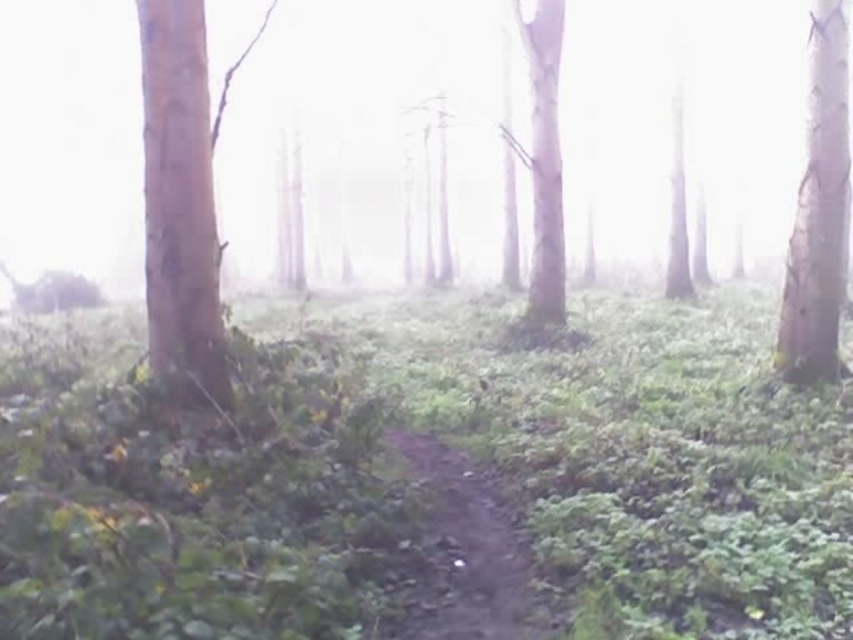
Question: Can you confirm if green leafy vegetation at center is wider than smooth brown tree trunk at left?

Choices:
 (A) no
 (B) yes

Answer: (B)

Question: Which of the following is the closest to the observer?

Choices:
 (A) smooth bark tree at center
 (B) dirt path at center
 (C) smooth brown tree trunk at left
 (D) green leafy vegetation at center

Answer: (D)

Question: Which point is closer to the camera?

Choices:
 (A) smooth bark tree at center
 (B) dirt path at center
 (C) foggy translucent forest at center
 (D) green leafy vegetation at center

Answer: (D)

Question: Considering the relative positions of foggy translucent forest at center and smooth white tree at right in the image provided, where is foggy translucent forest at center located with respect to smooth white tree at right?

Choices:
 (A) below
 (B) above

Answer: (B)

Question: Among these points, which one is nearest to the camera?

Choices:
 (A) (531, 289)
 (B) (466, 492)
 (C) (202, 68)
 (D) (838, 45)

Answer: (C)

Question: Does foggy translucent forest at center have a greater width compared to dirt path at center?

Choices:
 (A) no
 (B) yes

Answer: (B)